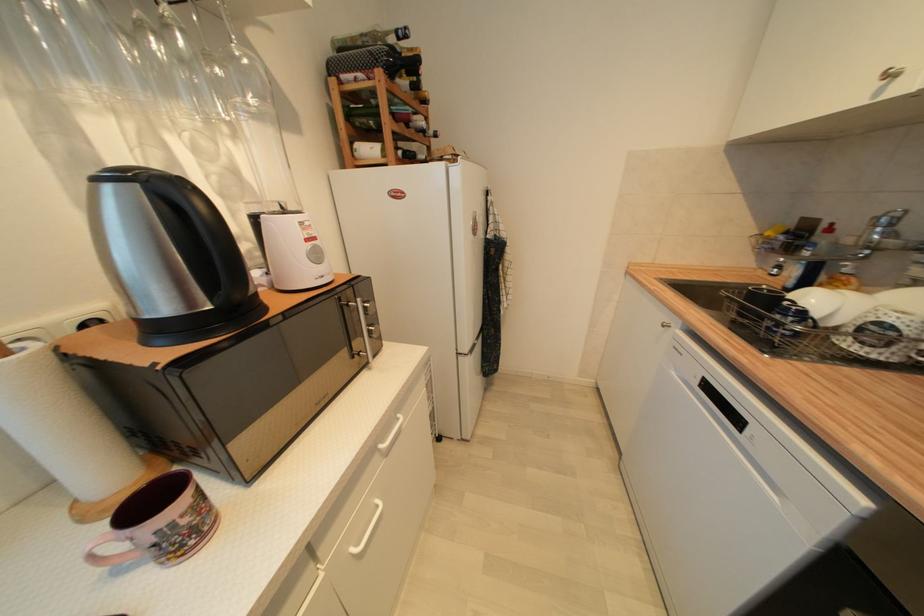
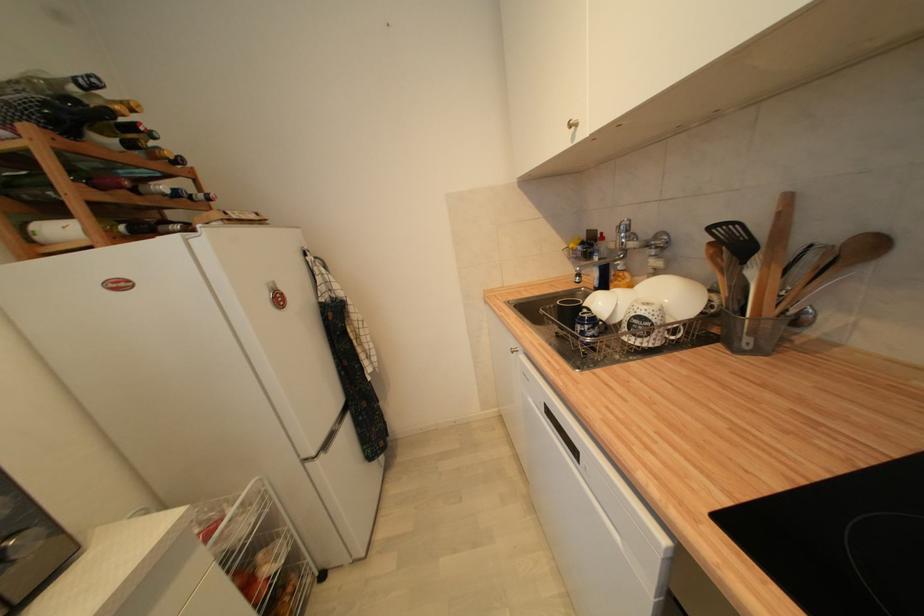
In the second image, find the point that corresponds to (441,137) in the first image.

(213, 200)